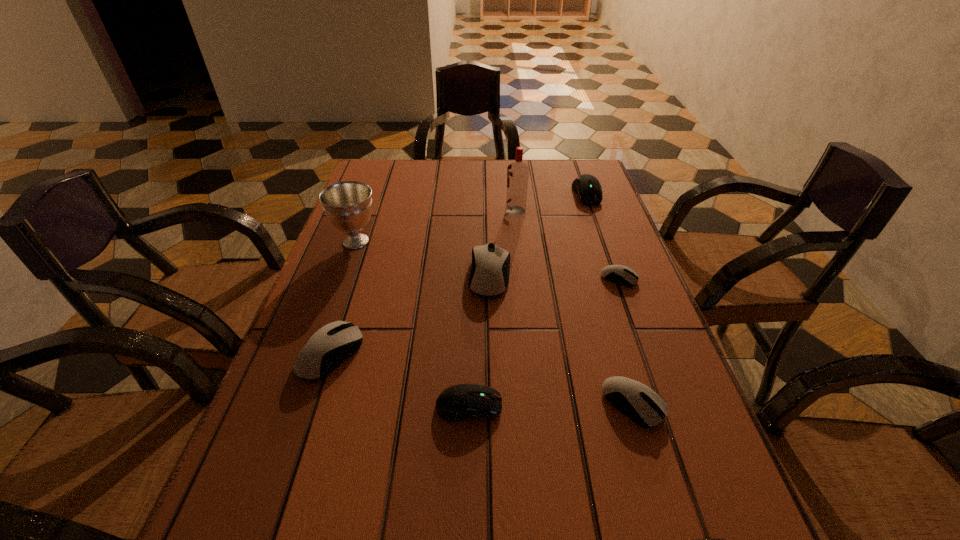
Find the location of a particular element. The width and height of the screenshot is (960, 540). free space that is in between the biggest dark computer equipment and the eighth shortest object is located at coordinates (471, 218).

Identify the location of free space between the smallest white mouse and the vodka. The image size is (960, 540). (567, 245).

Identify the location of vacant region between the red vodka and the second tallest object. (436, 226).

Where is `vacant area that lies between the smallest white mouse and the leftmost computer equipment`? The height and width of the screenshot is (540, 960). vacant area that lies between the smallest white mouse and the leftmost computer equipment is located at coordinates (475, 316).

Identify the location of free space between the third biggest white mouse and the third smallest white mouse. This screenshot has width=960, height=540. (482, 379).

Locate an element on the screen. The width and height of the screenshot is (960, 540). empty space between the second smallest white mouse and the leftmost computer equipment is located at coordinates (482, 379).

You are a GUI agent. You are given a task and a screenshot of the screen. Output one action in this format:
    pyautogui.click(x=<x>, y=<y>)
    Task: Click on the vacant space that's between the smallest white mouse and the biggest dark computer equipment
    
    Given the screenshot: What is the action you would take?
    pyautogui.click(x=603, y=236)

You are a GUI agent. You are given a task and a screenshot of the screen. Output one action in this format:
    pyautogui.click(x=<x>, y=<y>)
    Task: Click on the empty space that is in between the tallest object and the biggest white mouse
    The image size is (960, 540).
    Given the screenshot: What is the action you would take?
    pyautogui.click(x=503, y=243)

Choose which object is the eighth nearest neighbor to the second smallest white mouse. Please provide its 2D coordinates. Your answer should be formatted as a tuple, i.e. [(x, y)], where the tuple contains the x and y coordinates of a point satisfying the conditions above.

[(348, 205)]

This screenshot has width=960, height=540. In order to click on object that is the second closest to the nearest object in this screenshot , I will do `click(459, 402)`.